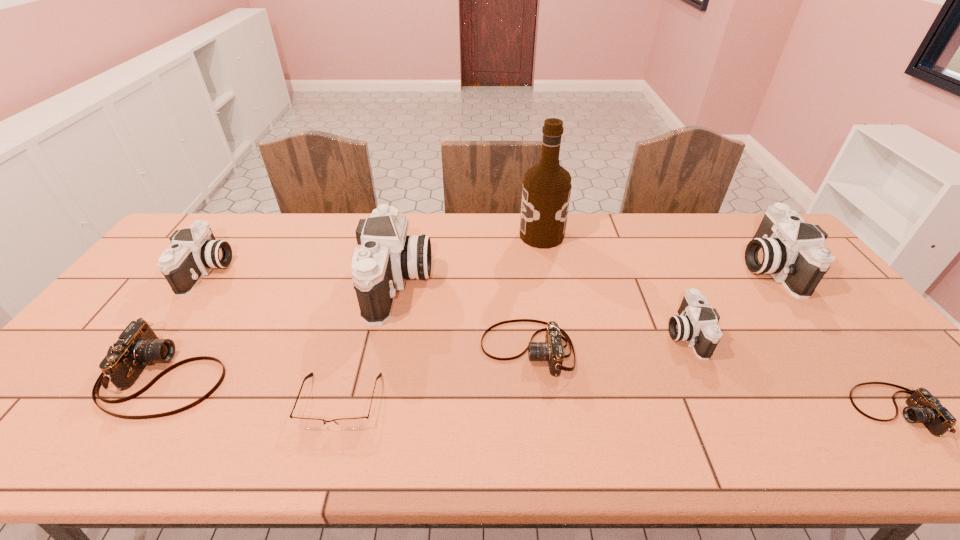
Identify the location of object present at the right edge. This screenshot has width=960, height=540. (785, 246).

What are the coordinates of `object positioned at the far left corner` in the screenshot? It's located at (194, 252).

Find the location of a particular element. object positioned at the far right corner is located at coordinates (785, 246).

You are a GUI agent. You are given a task and a screenshot of the screen. Output one action in this format:
    pyautogui.click(x=<x>, y=<y>)
    Task: Click on the free space at the far edge of the desktop
    Image resolution: width=960 pixels, height=540 pixels.
    Given the screenshot: What is the action you would take?
    pyautogui.click(x=505, y=248)

Image resolution: width=960 pixels, height=540 pixels. In the image, there is a desktop. Identify the location of blank space at the near edge. (219, 453).

You are a GUI agent. You are given a task and a screenshot of the screen. Output one action in this format:
    pyautogui.click(x=<x>, y=<y>)
    Task: Click on the vacant position at the right edge of the desktop
    The height and width of the screenshot is (540, 960).
    Given the screenshot: What is the action you would take?
    pyautogui.click(x=878, y=353)

You are a GUI agent. You are given a task and a screenshot of the screen. Output one action in this format:
    pyautogui.click(x=<x>, y=<y>)
    Task: Click on the vacant space at the far right corner
    The height and width of the screenshot is (540, 960).
    Given the screenshot: What is the action you would take?
    pyautogui.click(x=756, y=232)

Find the location of `free space between the fourth camera from left to right and the alcohol`. free space between the fourth camera from left to right and the alcohol is located at coordinates (535, 292).

You are a GUI agent. You are given a task and a screenshot of the screen. Output one action in this format:
    pyautogui.click(x=<x>, y=<y>)
    Task: Click on the vacant area that lies between the brown alcohol and the seventh tallest object
    The width and height of the screenshot is (960, 540).
    Given the screenshot: What is the action you would take?
    pyautogui.click(x=535, y=292)

The width and height of the screenshot is (960, 540). I want to click on free space between the fifth camera from right to left and the alcohol, so click(x=469, y=260).